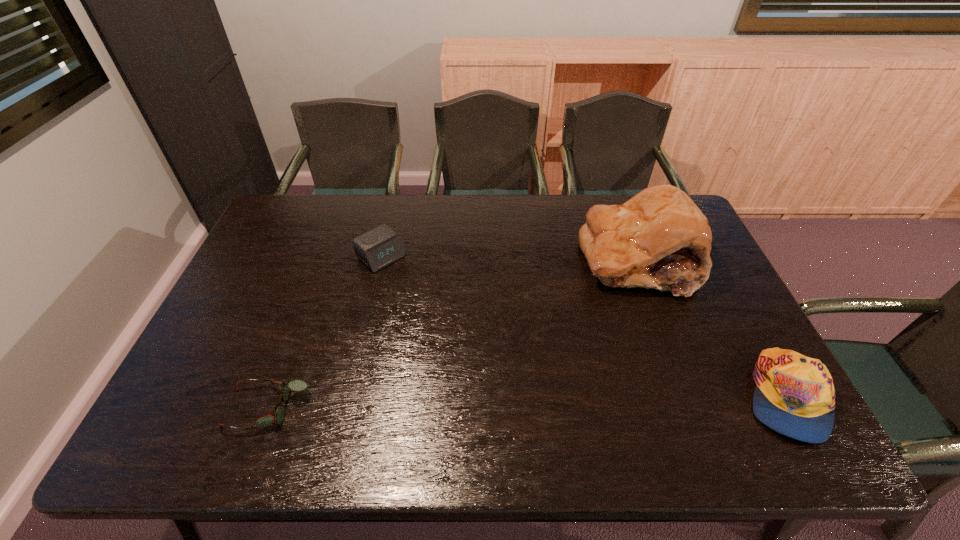
What are the coordinates of `vacant space positioned on the front-facing side of the alarm clock` in the screenshot? It's located at (467, 332).

This screenshot has width=960, height=540. Find the location of `vacant space located on the front-facing side of the alarm clock`. vacant space located on the front-facing side of the alarm clock is located at coordinates (420, 290).

In order to click on free space located 0.260m on the front-facing side of the alarm clock in this screenshot , I will do `click(450, 317)`.

Locate an element on the screen. The height and width of the screenshot is (540, 960). object at the far edge is located at coordinates tap(659, 239).

Where is `spectacles that is at the near edge`? The height and width of the screenshot is (540, 960). spectacles that is at the near edge is located at coordinates (297, 385).

Locate an element on the screen. The width and height of the screenshot is (960, 540). cap that is at the near edge is located at coordinates (794, 395).

Image resolution: width=960 pixels, height=540 pixels. What are the coordinates of `object situated at the left edge` in the screenshot? It's located at (297, 385).

This screenshot has width=960, height=540. I want to click on cap positioned at the right edge, so click(x=794, y=395).

Locate an element on the screen. bread that is at the right edge is located at coordinates (659, 239).

I want to click on object present at the near left corner, so tap(297, 385).